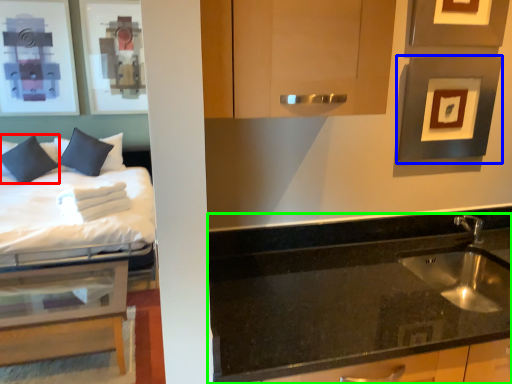
Question: Considering the real-world distances, which object is farthest from pillow (highlighted by a red box)? picture frame (highlighted by a blue box) or countertop (highlighted by a green box)?

Choices:
 (A) picture frame
 (B) countertop

Answer: (A)